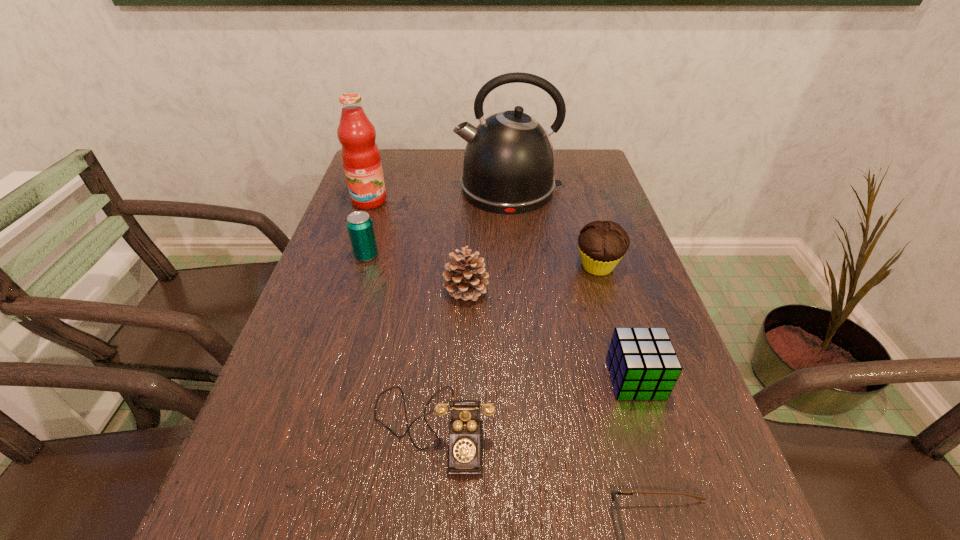
Identify the location of muffin that is positioned at the right edge. The height and width of the screenshot is (540, 960). [602, 244].

Locate an element on the screen. Image resolution: width=960 pixels, height=540 pixels. cube that is at the right edge is located at coordinates (642, 362).

Find the location of a particular element. The image size is (960, 540). object located in the far right corner section of the desktop is located at coordinates (509, 162).

This screenshot has width=960, height=540. Find the location of `free space at the far edge of the desktop`. free space at the far edge of the desktop is located at coordinates (417, 157).

This screenshot has height=540, width=960. In the image, there is a desktop. Identify the location of vacant region at the left edge. (286, 341).

The image size is (960, 540). In the image, there is a desktop. Find the location of `blank space at the right edge`. blank space at the right edge is located at coordinates [564, 206].

Locate an element on the screen. Image resolution: width=960 pixels, height=540 pixels. blank space at the far left corner of the desktop is located at coordinates (391, 150).

The height and width of the screenshot is (540, 960). I want to click on vacant space that's between the telephone and the muffin, so click(516, 347).

Locate an element on the screen. The width and height of the screenshot is (960, 540). blank region between the telephone and the fruit juice is located at coordinates (401, 315).

The height and width of the screenshot is (540, 960). In order to click on unoccupied area between the kettle and the beer can in this screenshot , I will do `click(438, 222)`.